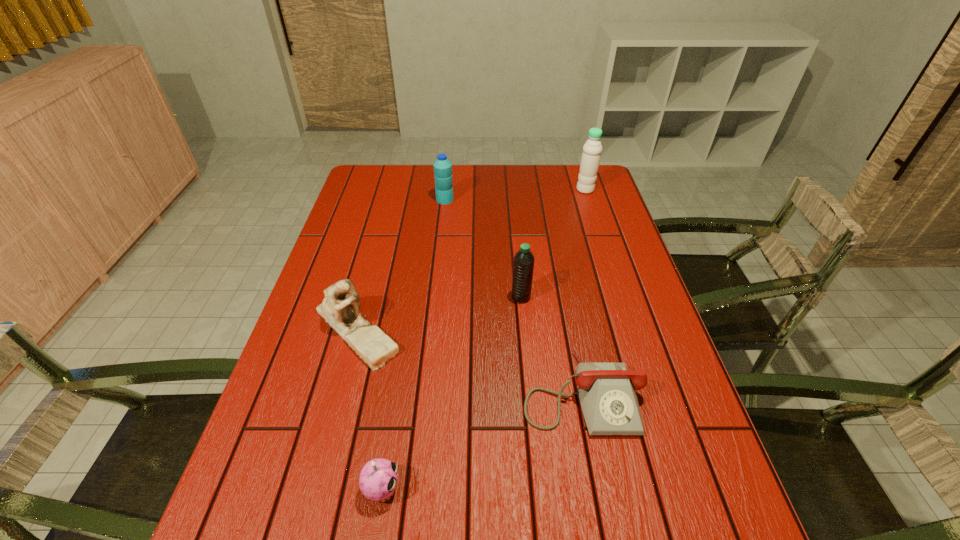
Find the location of a particular element. This screenshot has width=960, height=540. free space between the tallest object and the second farthest water bottle is located at coordinates (515, 194).

Where is `vacant area between the figurine and the nearest object`? vacant area between the figurine and the nearest object is located at coordinates (370, 409).

Identify which object is located as the fourth nearest to the farthest water bottle. Please provide its 2D coordinates. Your answer should be formatted as a tuple, i.e. [(x, y)], where the tuple contains the x and y coordinates of a point satisfying the conditions above.

[(340, 308)]

What are the coordinates of `the third closest object to the leftmost water bottle` in the screenshot? It's located at (523, 266).

Identify the location of water bottle identified as the closest to the figurine. Image resolution: width=960 pixels, height=540 pixels. (523, 266).

Locate which water bottle ranks second in proximity to the tallest water bottle. Please provide its 2D coordinates. Your answer should be formatted as a tuple, i.e. [(x, y)], where the tuple contains the x and y coordinates of a point satisfying the conditions above.

[(523, 266)]

Where is `vacant space that satisfies the following two spatial constraints: 1. on the dial of the telephone; 2. on the face of the nearest object`? vacant space that satisfies the following two spatial constraints: 1. on the dial of the telephone; 2. on the face of the nearest object is located at coordinates (599, 489).